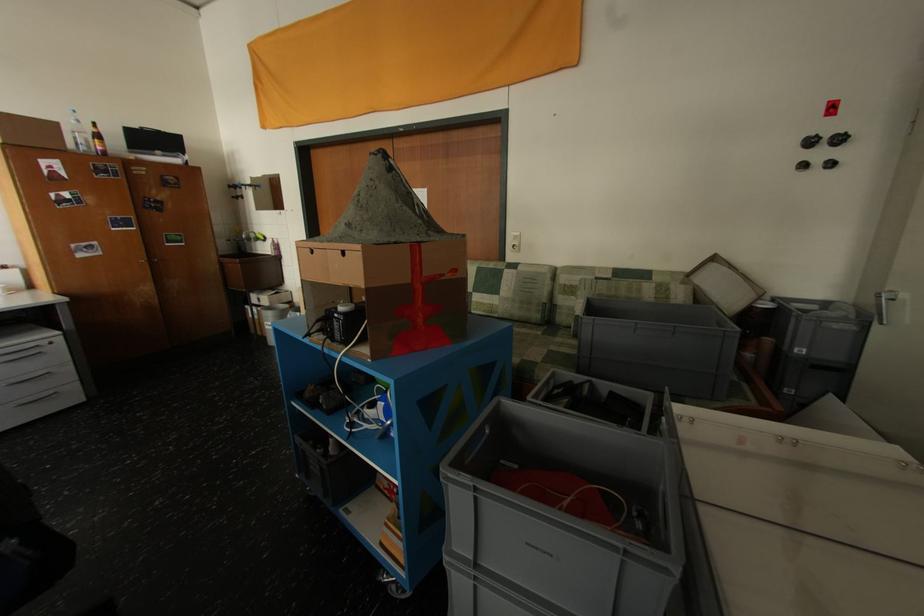
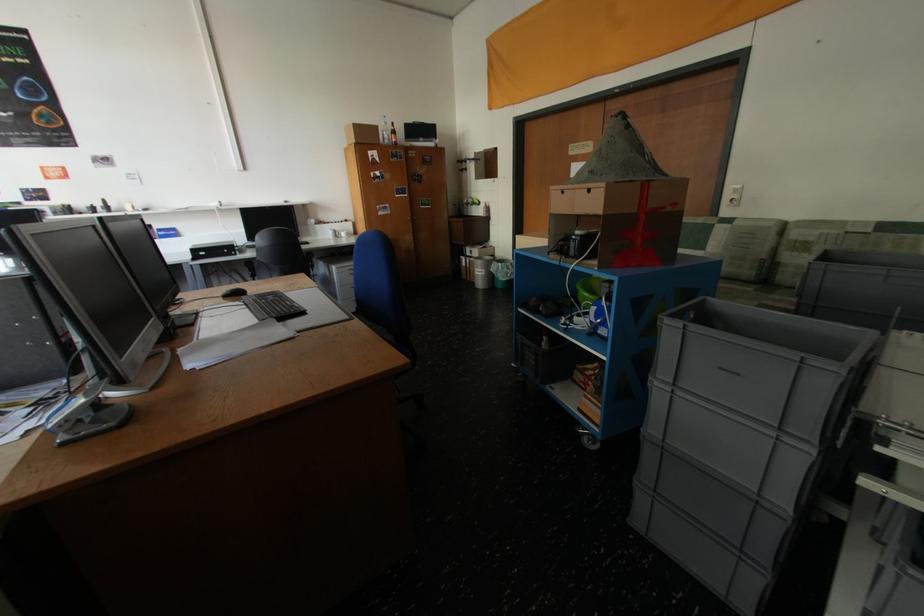
The point at (351, 254) is marked in the first image. Where is the corresponding point in the second image?

(598, 192)